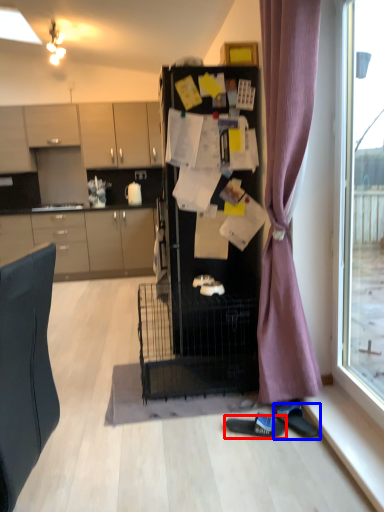
Question: Which point is closer to the camera, footwear (highlighted by a red box) or footwear (highlighted by a blue box)?

Choices:
 (A) footwear
 (B) footwear

Answer: (B)